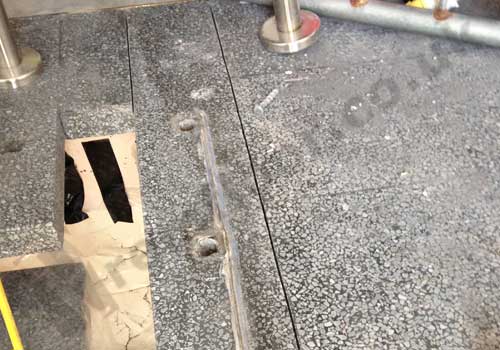
Where is `seam in floor`? The image size is (500, 350). seam in floor is located at coordinates (278, 264).